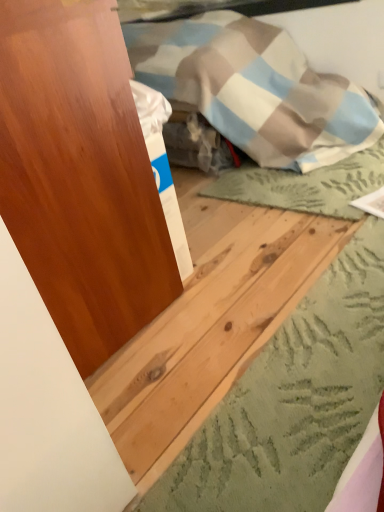
You are a GUI agent. You are given a task and a screenshot of the screen. Output one action in this format:
    pyautogui.click(x=<x>, y=<y>)
    Task: Click on the vacant point above natural wood plank at center (from a real-world perspective)
    Image resolution: width=384 pixels, height=512 pixels.
    Given the screenshot: What is the action you would take?
    [x=325, y=350]